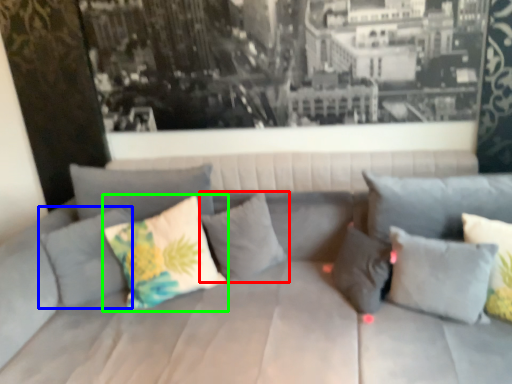
Question: Considering the real-world distances, which object is closest to pillow (highlighted by a red box)? pillow (highlighted by a blue box) or pillow (highlighted by a green box).

Choices:
 (A) pillow
 (B) pillow

Answer: (B)